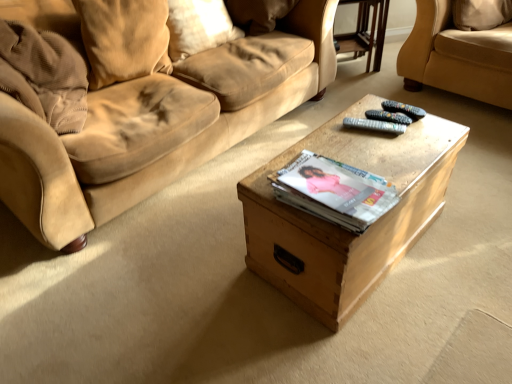
This screenshot has height=384, width=512. In order to click on empty space that is in between black plastic remote at center, marked as the 1th remote in a bottom-to-top arrangement, and matte paper magazine at center in this screenshot , I will do `click(368, 149)`.